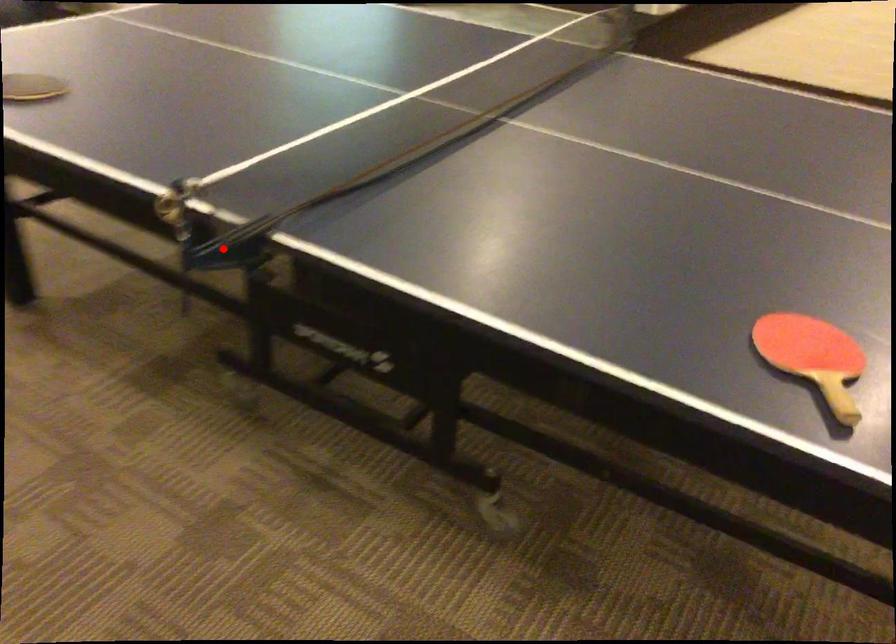
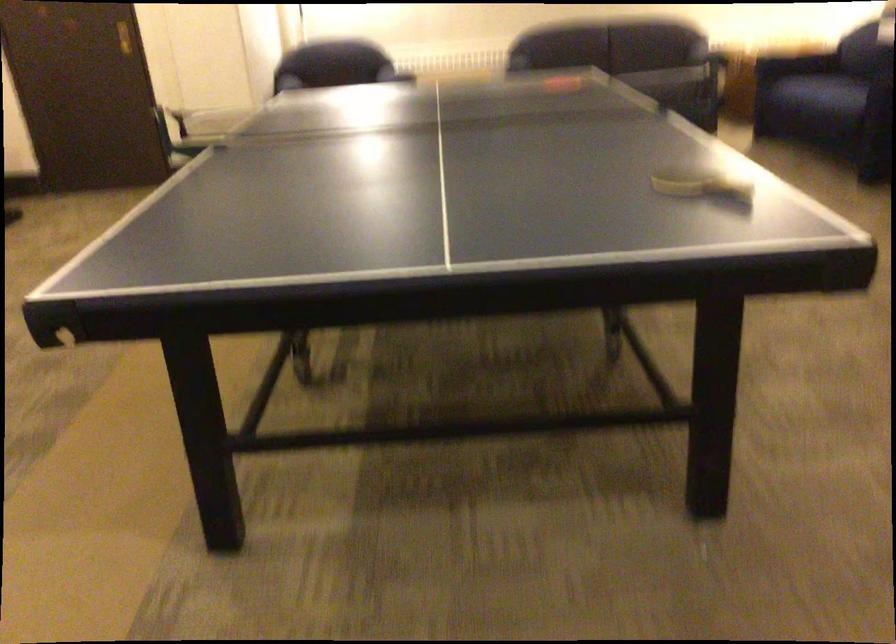
Where in the second image is the point corresponding to the highlighted location from the first image?

(668, 82)